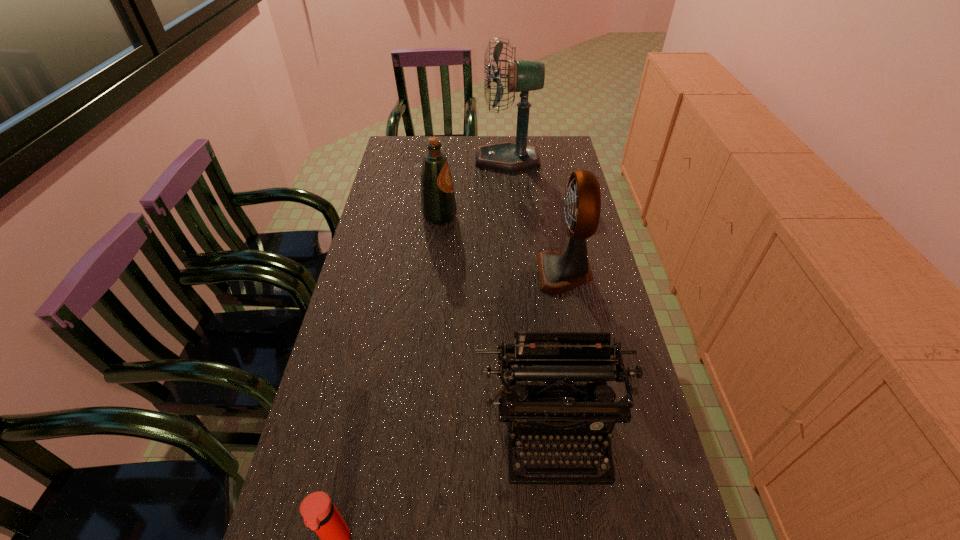
Find the location of `the taller fan`. the taller fan is located at coordinates (523, 76).

Where is `the farther fan`? The width and height of the screenshot is (960, 540). the farther fan is located at coordinates (523, 76).

Where is `the nearer fan`? This screenshot has width=960, height=540. the nearer fan is located at coordinates (559, 272).

Identify the location of the third nearest object. The height and width of the screenshot is (540, 960). (559, 272).

Where is `olive oil`? Image resolution: width=960 pixels, height=540 pixels. olive oil is located at coordinates (438, 206).

What are the coordinates of `the fourth nearest object` in the screenshot? It's located at (438, 206).

Find the location of `the fourth farthest object`. the fourth farthest object is located at coordinates (551, 357).

Locate an element on the screen. free region located in front of the tallest object where the wind blows is located at coordinates (388, 159).

Locate an element on the screen. This screenshot has width=960, height=540. vacant space situated in front of the tallest object where the wind blows is located at coordinates (453, 159).

What are the coordinates of `vacant space located in front of the tallest object where the wind blows` in the screenshot? It's located at (441, 159).